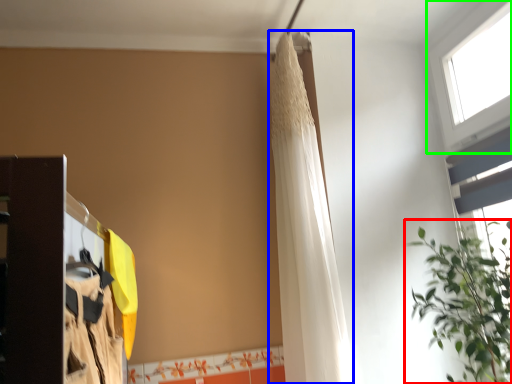
Question: Considering the real-world distances, which object is closest to houseplant (highlighted by a red box)? shower curtain (highlighted by a blue box) or window (highlighted by a green box).

Choices:
 (A) shower curtain
 (B) window

Answer: (A)